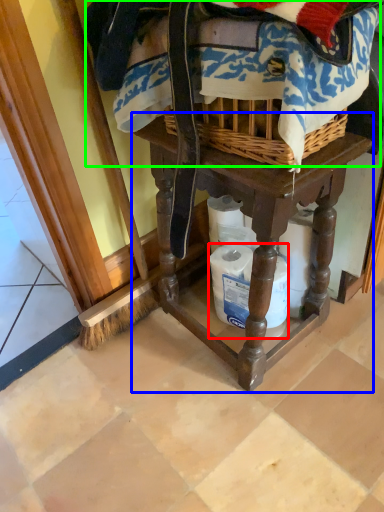
Question: Estimate the real-world distances between objects in this image. Which object is closer to toilet paper (highlighted by a red box), furniture (highlighted by a blue box) or clothing (highlighted by a green box)?

Choices:
 (A) furniture
 (B) clothing

Answer: (A)